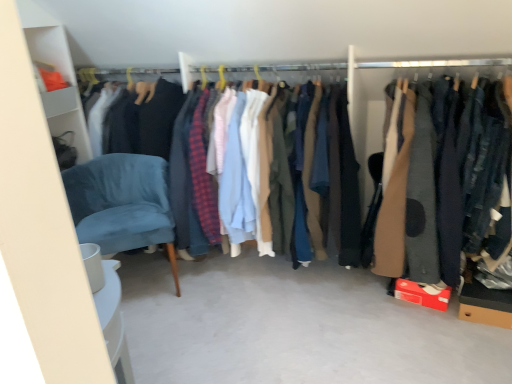
Find the location of a particular element. The image size is (512, 384). free point below matte cotton shirts at center, which appears as the first clothing when viewed from the left (from a real-world perspective) is located at coordinates (273, 276).